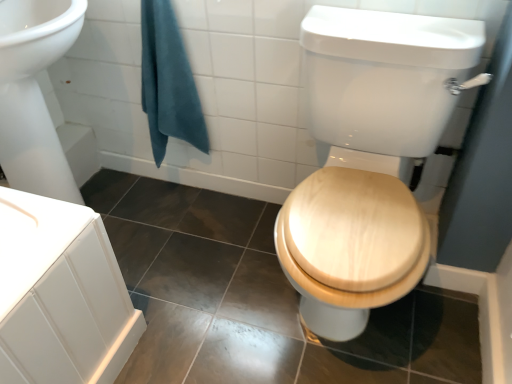
Question: Does teal cotton towel at upper left have a smaller size compared to wooden toilet seat at center?

Choices:
 (A) no
 (B) yes

Answer: (B)

Question: Is teal cotton towel at upper left at the right side of wooden toilet seat at center?

Choices:
 (A) no
 (B) yes

Answer: (A)

Question: Is teal cotton towel at upper left bigger than wooden toilet seat at center?

Choices:
 (A) no
 (B) yes

Answer: (A)

Question: Is teal cotton towel at upper left further to camera compared to wooden toilet seat at center?

Choices:
 (A) no
 (B) yes

Answer: (B)

Question: From the image's perspective, is teal cotton towel at upper left located above wooden toilet seat at center?

Choices:
 (A) no
 (B) yes

Answer: (B)

Question: Is wooden toilet seat at center inside teal cotton towel at upper left?

Choices:
 (A) yes
 (B) no

Answer: (B)

Question: Is wooden toilet seat at center outside of teal cotton towel at upper left?

Choices:
 (A) yes
 (B) no

Answer: (A)

Question: Is wooden toilet seat at center to the left of teal cotton towel at upper left from the viewer's perspective?

Choices:
 (A) yes
 (B) no

Answer: (B)

Question: Considering the relative positions of wooden toilet seat at center and teal cotton towel at upper left in the image provided, is wooden toilet seat at center behind teal cotton towel at upper left?

Choices:
 (A) no
 (B) yes

Answer: (A)

Question: From a real-world perspective, is wooden toilet seat at center physically below teal cotton towel at upper left?

Choices:
 (A) yes
 (B) no

Answer: (A)

Question: Considering the relative positions of wooden toilet seat at center and teal cotton towel at upper left in the image provided, is wooden toilet seat at center in front of teal cotton towel at upper left?

Choices:
 (A) no
 (B) yes

Answer: (B)

Question: Can you confirm if wooden toilet seat at center is thinner than teal cotton towel at upper left?

Choices:
 (A) yes
 (B) no

Answer: (B)

Question: From the image's perspective, relative to teal cotton towel at upper left, is wooden toilet seat at center above or below?

Choices:
 (A) below
 (B) above

Answer: (A)